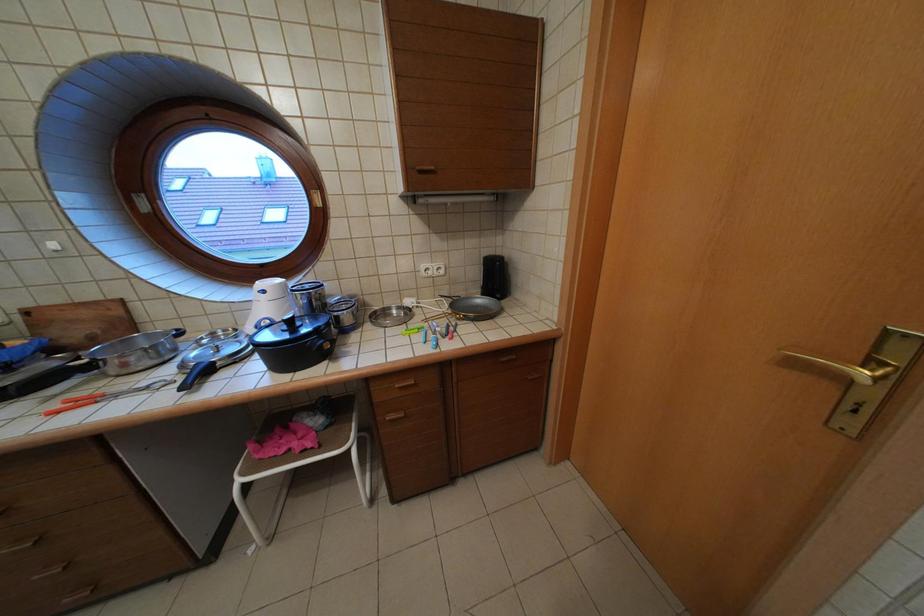
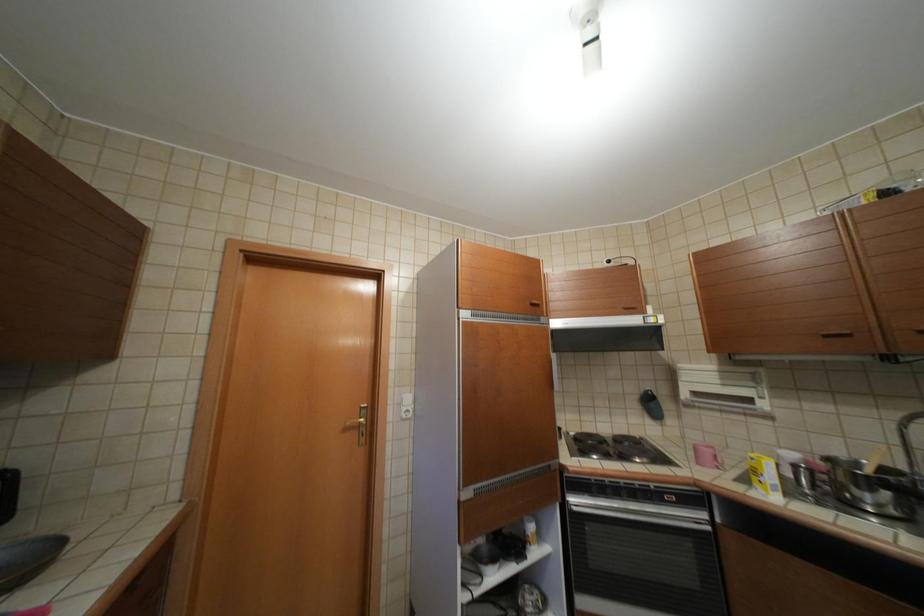
Question: The camera is either moving clockwise (left) or counter-clockwise (right) around the object. The first image is from the beginning of the video and the second image is from the end. Is the camera moving left or right when shooting the video?

Choices:
 (A) Left
 (B) Right

Answer: (A)